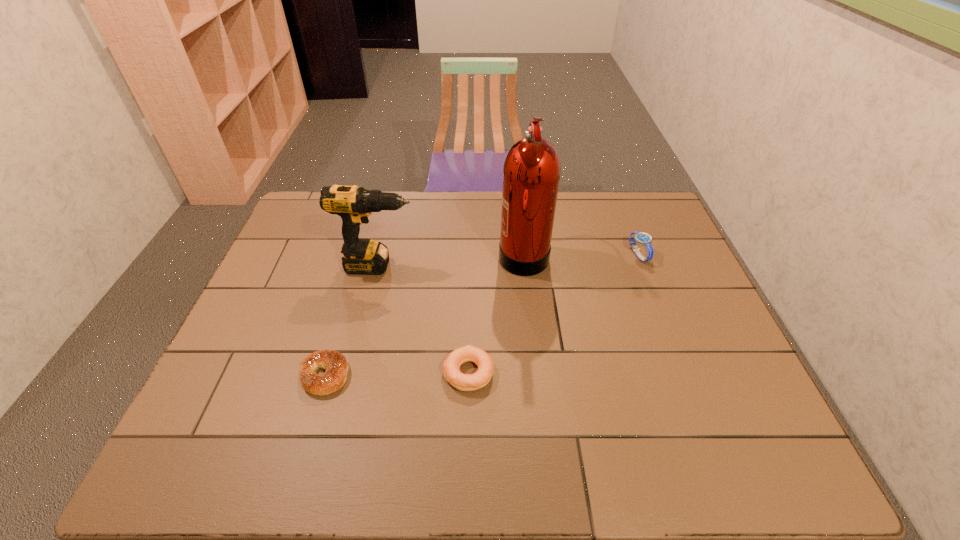
Where is `vacant area located 0.280m at the tip of the second tallest object`? vacant area located 0.280m at the tip of the second tallest object is located at coordinates (510, 266).

You are a GUI agent. You are given a task and a screenshot of the screen. Output one action in this format:
    pyautogui.click(x=<x>, y=<y>)
    Task: Click on the free location located on the right of the third shortest object
    This screenshot has width=960, height=540.
    Given the screenshot: What is the action you would take?
    pyautogui.click(x=666, y=255)

Where is `free space located on the back of the third object from right to left`? free space located on the back of the third object from right to left is located at coordinates [x=470, y=301].

You are a GUI agent. You are given a task and a screenshot of the screen. Output one action in this format:
    pyautogui.click(x=<x>, y=<y>)
    Task: Click on the free space located on the left of the left bagel
    The image size is (960, 540).
    Given the screenshot: What is the action you would take?
    pyautogui.click(x=217, y=375)

Where is `object that is at the far edge`? The image size is (960, 540). object that is at the far edge is located at coordinates (531, 173).

Identify the location of object present at the right edge. Image resolution: width=960 pixels, height=540 pixels. (643, 238).

Locate an element on the screen. Image resolution: width=960 pixels, height=540 pixels. vacant space at the far edge of the desktop is located at coordinates pyautogui.click(x=587, y=197).

In the image, there is a desktop. Where is `vacant space at the near edge`? Image resolution: width=960 pixels, height=540 pixels. vacant space at the near edge is located at coordinates (335, 439).

You are a GUI agent. You are given a task and a screenshot of the screen. Output one action in this format:
    pyautogui.click(x=<x>, y=<y>)
    Task: Click on the free location at the left edge of the desktop
    
    Given the screenshot: What is the action you would take?
    pyautogui.click(x=238, y=359)

Identify the location of vacant space at the right edge of the desktop. (691, 287).